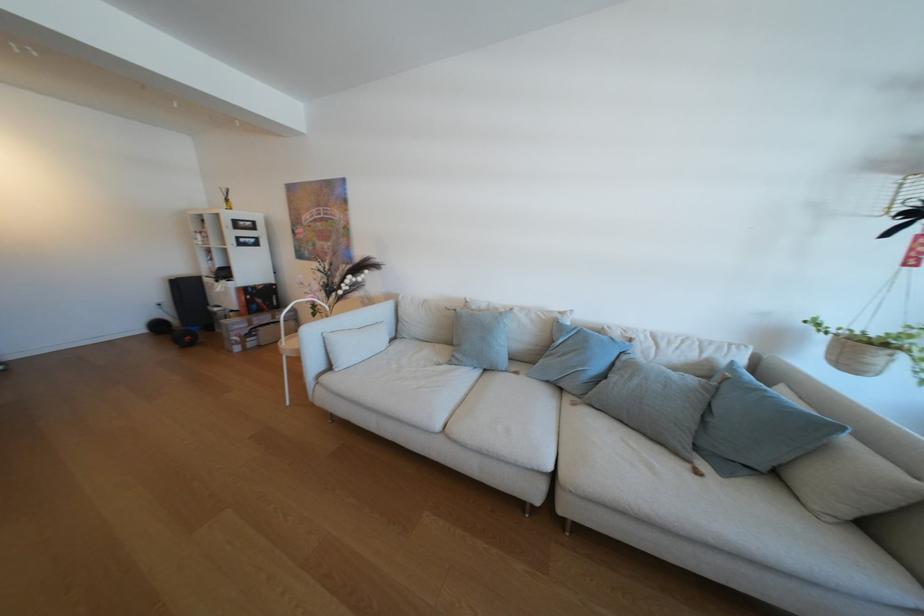
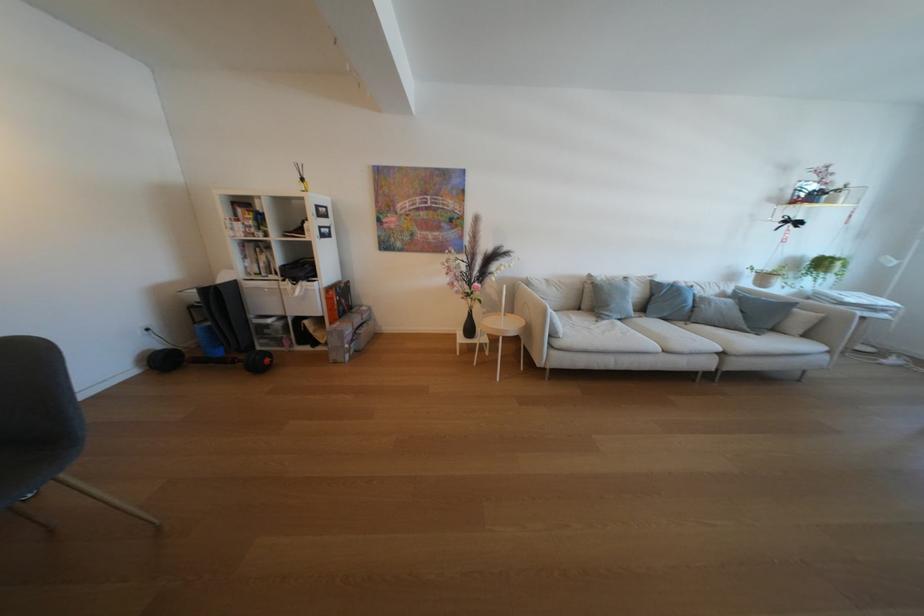
Find the pixel in the second image that matches point 712,352 in the first image.

(730, 289)